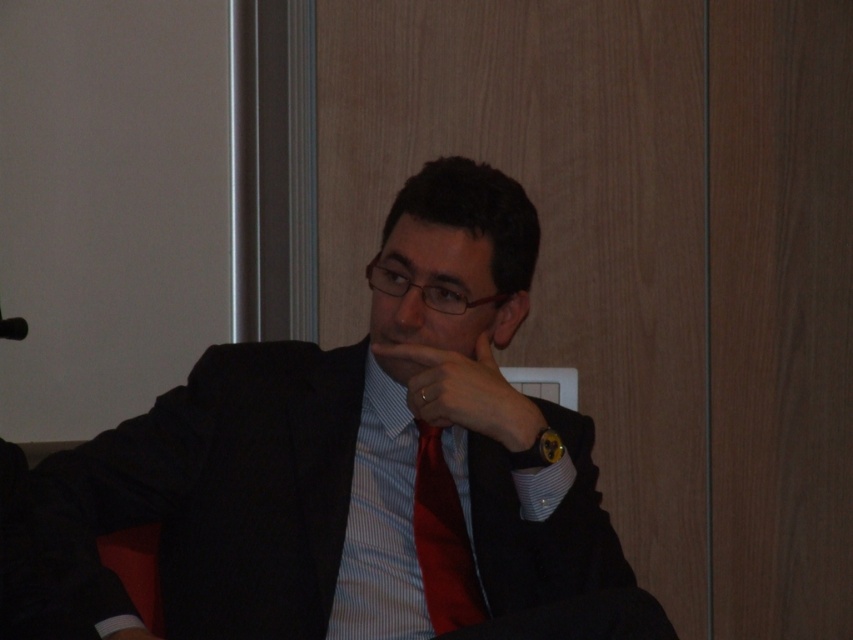
The man in the scene is wearing a red satin tie at center and has a matte glass nose at center. Which object is positioned to the right side?

The red satin tie at center is to the right of the matte glass nose at center.